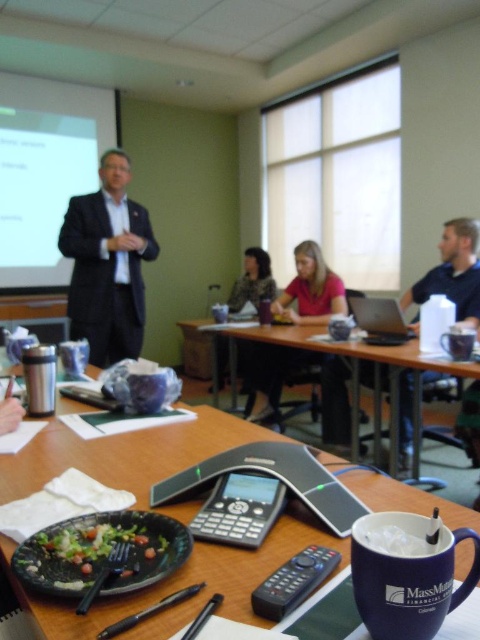
Is patterned fabric shirt at center to the left of satin silver laptop at center from the viewer's perspective?

Yes, patterned fabric shirt at center is to the left of satin silver laptop at center.

Where is `patterned fabric shirt at center`? patterned fabric shirt at center is located at coordinates (252, 282).

Who is more distant from viewer, (242, 284) or (389, 300)?

Positioned behind is point (242, 284).

The height and width of the screenshot is (640, 480). I want to click on patterned fabric shirt at center, so click(x=252, y=282).

What do you see at coordinates (350, 371) in the screenshot? I see `smooth plastic conference table at center` at bounding box center [350, 371].

Can you confirm if smooth plastic conference table at center is wider than satin silver laptop at center?

Yes, smooth plastic conference table at center is wider than satin silver laptop at center.

The image size is (480, 640). Find the location of `smooth plastic conference table at center`. smooth plastic conference table at center is located at coordinates (350, 371).

Locate an element on the screen. smooth plastic conference table at center is located at coordinates click(350, 371).

Does black suit at center appear over blue fabric shirt at right?

Indeed, black suit at center is positioned over blue fabric shirt at right.

Is black suit at center positioned in front of blue fabric shirt at right?

No, black suit at center is behind blue fabric shirt at right.

Does point (74, 275) come closer to viewer compared to point (410, 326)?

That is False.

At what (x,y) coordinates should I click in order to perform the action: click on black suit at center. Please return your answer as a coordinate pair (x, y). The height and width of the screenshot is (640, 480). Looking at the image, I should click on (108, 264).